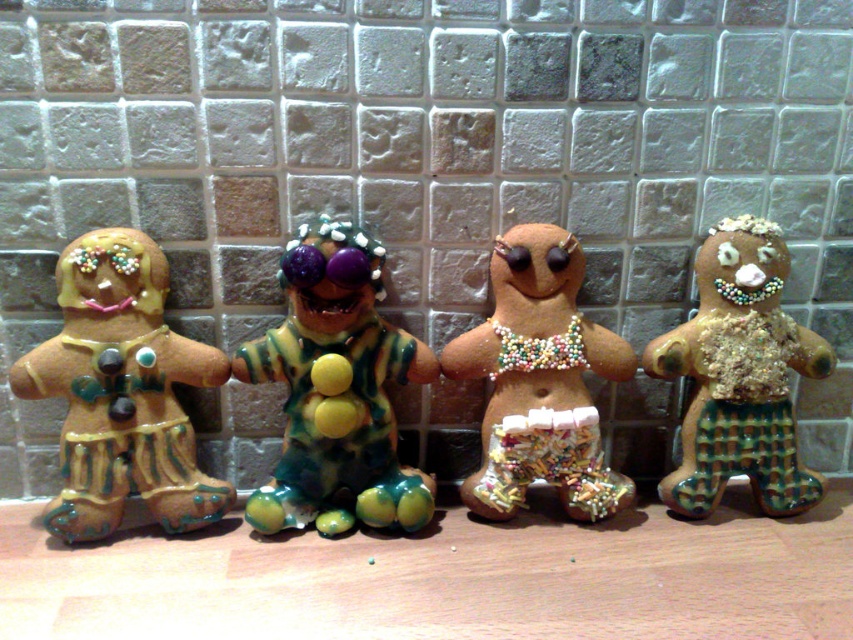
You are a child trying to reach both the matte brown gingerbread man at left and the glossy ceramic gingerbread man at center displayed on a shelf. Which one will require you to stand on your tiptoes to reach?

The glossy ceramic gingerbread man at center is taller than the matte brown gingerbread man at left, so you will need to stand on your tiptoes to reach the glossy ceramic gingerbread man at center.

You are a child trying to reach both the glittery gingerbread man at center and the glittery brown gingerbread man at right from the ground. Which one is easier to reach?

The glittery gingerbread man at center is positioned under the glittery brown gingerbread man at right, so it is lower and easier to reach.